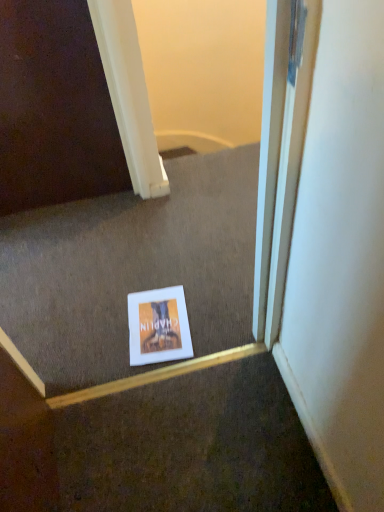
At what (x,y) coordinates should I click in order to perform the action: click on empty space that is ontop of matte cardboard book at center (from a real-world perspective). Please return your answer as a coordinate pair (x, y). This screenshot has width=384, height=512. Looking at the image, I should click on (158, 322).